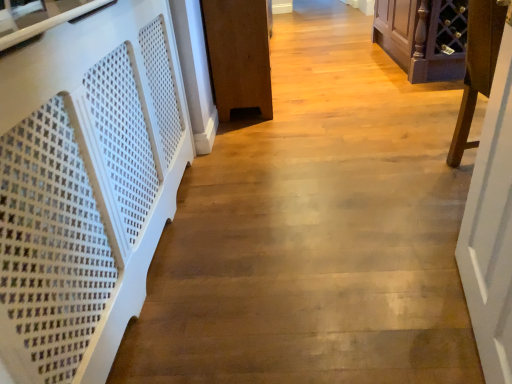
I want to click on free space in front of brown wood cabinet at center, the 3th furniture viewed from the right, so click(x=282, y=138).